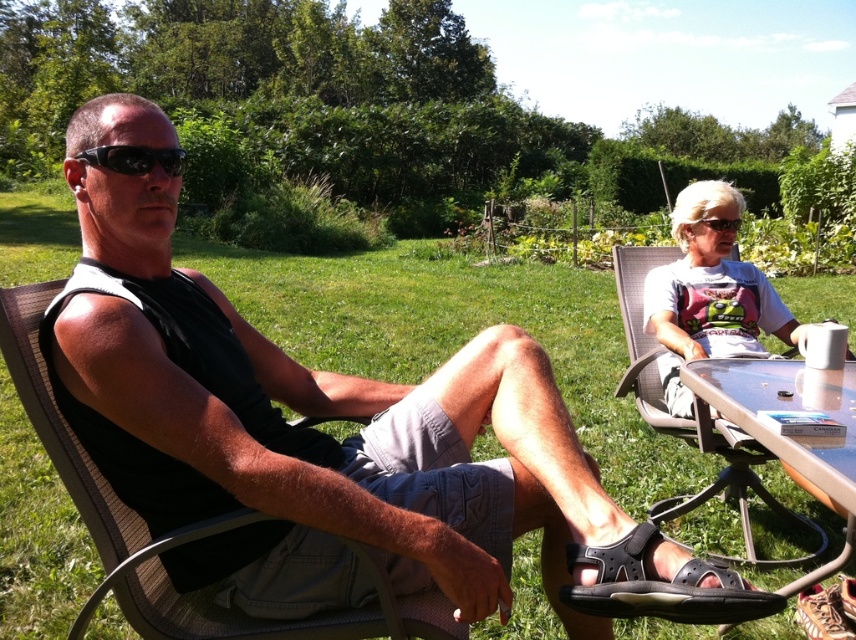
You are planning to place a new decorative pillow that is 1.2 meters wide on the brown mesh chair at left. Considering the black fabric tank top at left is currently on the chair, do you think the pillow will fit on the chair without overlapping the tank top?

The black fabric tank top at left might be wider than the brown mesh chair at left, so placing a 1.2 meter wide pillow might not fit properly as the tank top could be wider than the chair itself, causing overlap.

You are planning to place a decorative item on the transparent glass table at lower right and the black matte sunglasses at upper left. Considering their sizes, which object can accommodate a larger item?

The transparent glass table at lower right has a greater width than the black matte sunglasses at upper left, so it can accommodate a larger item.

You are an observer looking at the scene. You notice two black items in the image. The first is the black fabric tank top at left, and the second is the black matte sunglasses at upper left. Which of these two items is located more to the right?

The black fabric tank top at left is positioned on the right side of black matte sunglasses at upper left, so the black fabric tank top at left is more to the right.